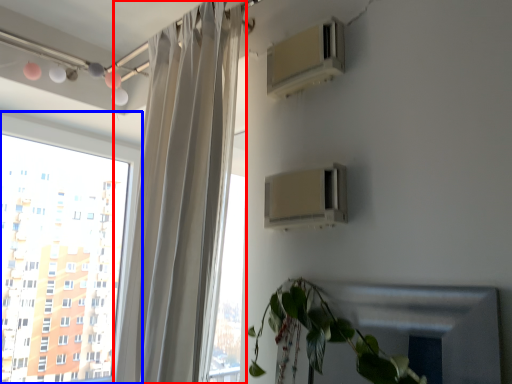
Question: Which object is further to the camera taking this photo, curtain (highlighted by a red box) or window (highlighted by a blue box)?

Choices:
 (A) curtain
 (B) window

Answer: (B)